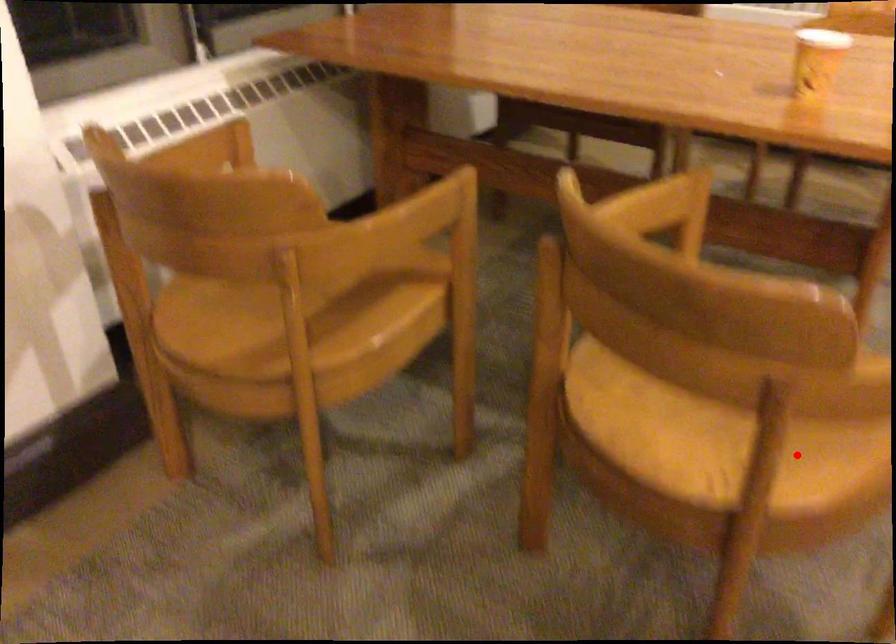
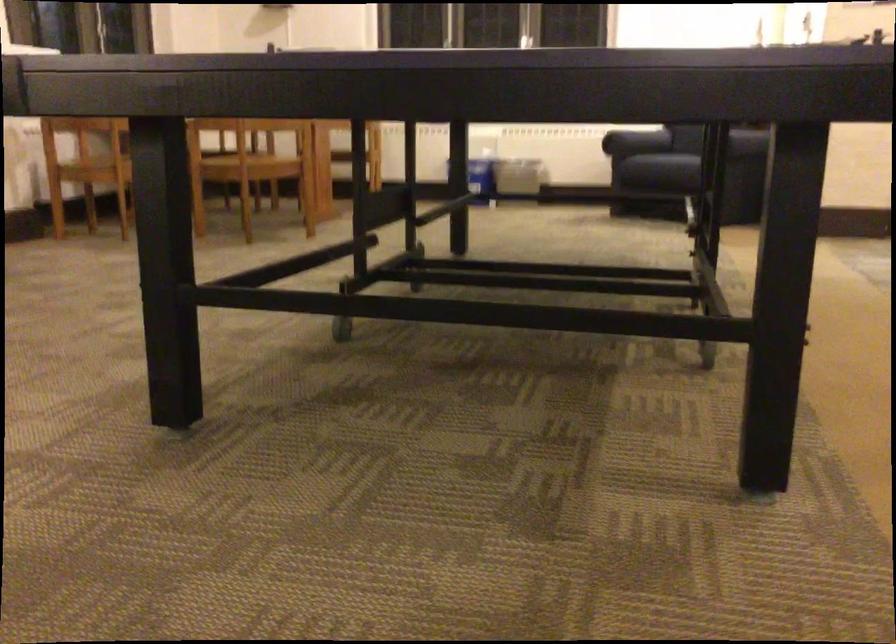
Question: A red point is marked in image1. In image2, is the corresponding 3D point closer to the camera or farther? Reply with the corresponding letter.

Choices:
 (A) The corresponding 3D point is closer.
 (B) The corresponding 3D point is farther.

Answer: (B)